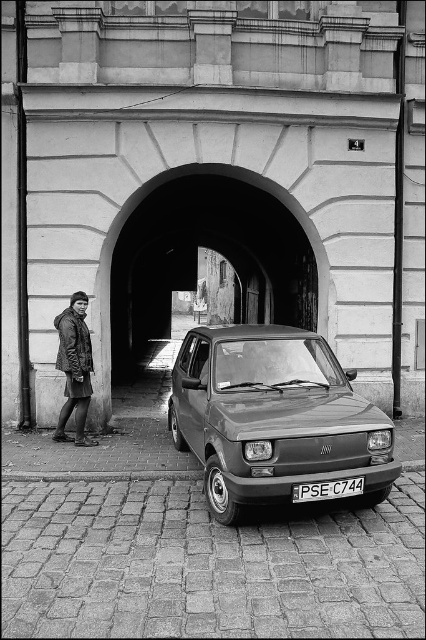
You are a photographer trying to capture the smooth stone archway at center and the dark gray jacket at left in a single frame. Based on their sizes, which object should you focus on first to ensure both fit in the shot?

The smooth stone archway at center is wider than the dark gray jacket at left, so focusing on the archway first will help ensure both objects fit in the frame.

You are a delivery person trying to load a large package onto a cart. The cart is parked next to the matte gray hatchback at center and the dark gray jacket at left. Which object should you avoid bumping into to prevent damaging the taller one?

The dark gray jacket at left is taller than the matte gray hatchback at center, so you should avoid bumping into the dark gray jacket at left to prevent damaging the taller one.

You are a delivery driver who needs to park your vehicle in this location. The parking spot is marked at coordinates point 0.65, 0.64. Is the matte gray hatchback at center currently occupying that spot?

The matte gray hatchback at center is located at point [273,417], which is very close to the parking spot at [272,416]. Since the coordinates are nearly identical, the matte gray hatchback at center is occupying that parking spot.